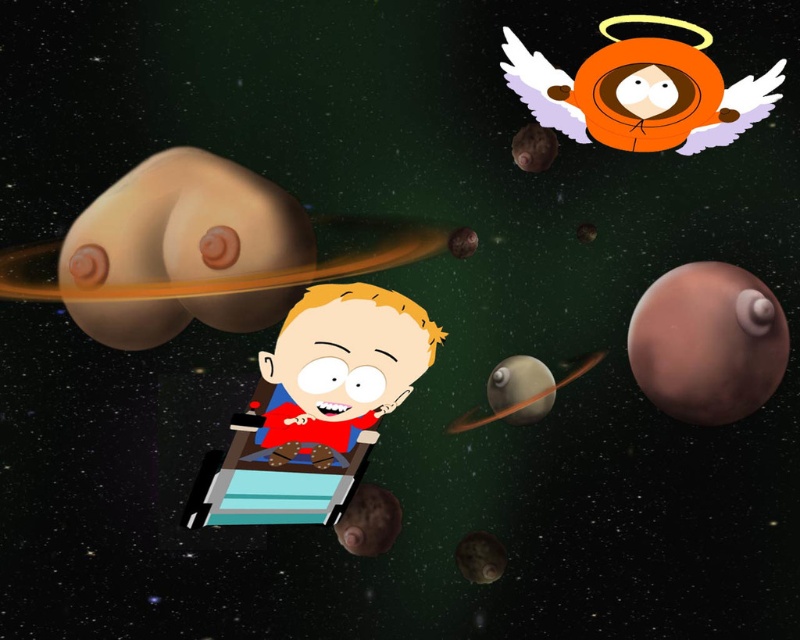
Question: Is smooth brown planet at center closer to camera compared to smooth brown planet at lower center?

Choices:
 (A) yes
 (B) no

Answer: (A)

Question: Among these points, which one is farthest from the camera?

Choices:
 (A) (516, 416)
 (B) (496, 541)
 (C) (782, 355)

Answer: (A)

Question: Which object appears farthest from the camera in this image?

Choices:
 (A) smooth brown planet at center
 (B) brown matte planet at upper right
 (C) smooth beige planet at left
 (D) smooth red astronaut at center

Answer: (A)

Question: Does smooth red astronaut at center have a greater width compared to brown matte planet at upper right?

Choices:
 (A) no
 (B) yes

Answer: (A)

Question: Which point is farther to the camera?

Choices:
 (A) smooth brown planet at center
 (B) smooth red astronaut at center
 (C) smooth brown planet at lower center
 (D) brown matte planet at upper right

Answer: (C)

Question: Does brown matte planet at upper right have a larger size compared to smooth brown planet at lower center?

Choices:
 (A) no
 (B) yes

Answer: (B)